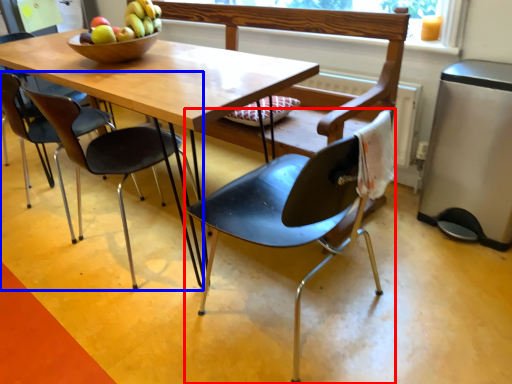
Question: Which point is closer to the camera, chair (highlighted by a red box) or chair (highlighted by a blue box)?

Choices:
 (A) chair
 (B) chair

Answer: (A)